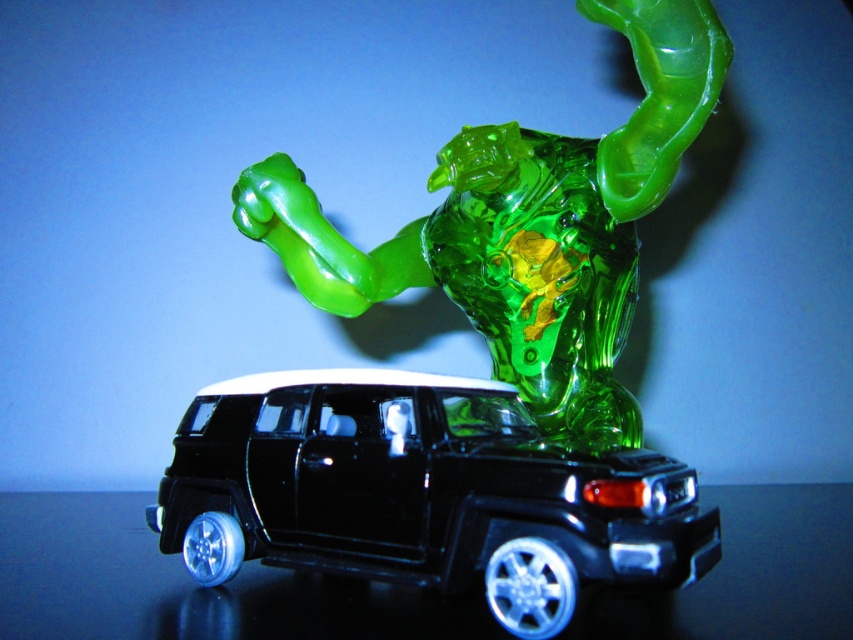
Question: From the image, what is the correct spatial relationship of black plastic toy car at center in relation to translucent green figure at upper center?

Choices:
 (A) below
 (B) above

Answer: (A)

Question: Considering the relative positions of black plastic toy car at center and translucent green figure at upper center in the image provided, where is black plastic toy car at center located with respect to translucent green figure at upper center?

Choices:
 (A) right
 (B) left

Answer: (B)

Question: Which point is farther to the camera?

Choices:
 (A) (469, 476)
 (B) (691, 12)

Answer: (B)

Question: Is black plastic toy car at center positioned at the back of translucent green figure at upper center?

Choices:
 (A) no
 (B) yes

Answer: (A)